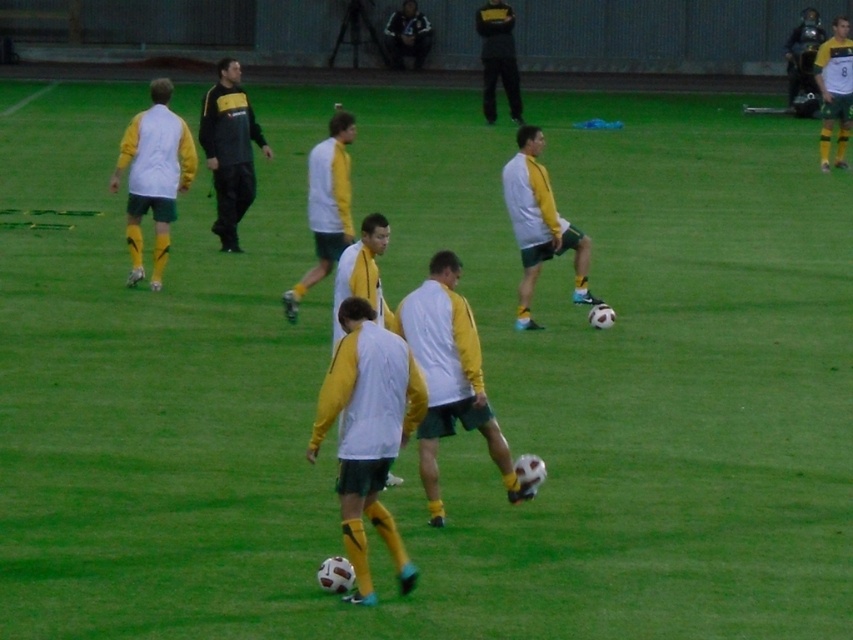
Describe the element at coordinates (538, 225) in the screenshot. This screenshot has height=640, width=853. I see `yellow matte jacket at center` at that location.

Consider the image. Which is below, yellow matte jacket at center or shiny black helmet at upper right?

yellow matte jacket at center is lower down.

This screenshot has height=640, width=853. Describe the element at coordinates (538, 225) in the screenshot. I see `yellow matte jacket at center` at that location.

Where is `yellow matte jacket at center`? yellow matte jacket at center is located at coordinates (538, 225).

The height and width of the screenshot is (640, 853). I want to click on white matte jersey at center, so click(368, 433).

Between black matte jacket at center and dark blue leather jacket at center, which one has less height?

dark blue leather jacket at center is shorter.

Looking at this image, who is more distant from viewer, (x=202, y=109) or (x=407, y=12)?

Positioned behind is point (x=407, y=12).

At what (x,y) coordinates should I click in order to perform the action: click on black matte jacket at center. Please return your answer as a coordinate pair (x, y). The height and width of the screenshot is (640, 853). Looking at the image, I should click on (229, 148).